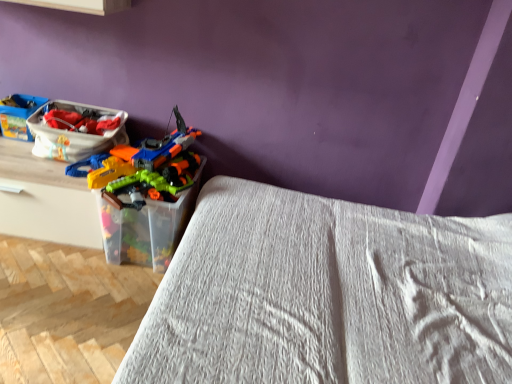
Question: Is translucent plastic container at center positioned beyond the bounds of matte plastic toy boat at left, marked as the first kit in a left-to-right arrangement?

Choices:
 (A) no
 (B) yes

Answer: (B)

Question: Does translucent plastic container at center have a larger size compared to matte plastic toy boat at left, the second kit when ordered from right to left?

Choices:
 (A) no
 (B) yes

Answer: (B)

Question: Is translucent plastic container at center turned away from matte plastic toy boat at left, the second kit when ordered from right to left?

Choices:
 (A) no
 (B) yes

Answer: (A)

Question: From a real-world perspective, is translucent plastic container at center on top of matte plastic toy boat at left, marked as the first kit in a left-to-right arrangement?

Choices:
 (A) no
 (B) yes

Answer: (A)

Question: Is translucent plastic container at center further to the viewer compared to matte plastic toy boat at left, marked as the first kit in a left-to-right arrangement?

Choices:
 (A) no
 (B) yes

Answer: (A)

Question: Considering the relative positions of translucent plastic container at center and matte plastic toy boat at left, marked as the first kit in a left-to-right arrangement, in the image provided, is translucent plastic container at center in front of matte plastic toy boat at left, marked as the first kit in a left-to-right arrangement,?

Choices:
 (A) yes
 (B) no

Answer: (A)

Question: From a real-world perspective, is matte plastic toy boat at left, the second kit when ordered from right to left, physically above translucent plastic container at center?

Choices:
 (A) no
 (B) yes

Answer: (B)

Question: From the image's perspective, is matte plastic toy boat at left, the second kit when ordered from right to left, located beneath translucent plastic container at center?

Choices:
 (A) no
 (B) yes

Answer: (A)

Question: Is the position of matte plastic toy boat at left, the second kit when ordered from right to left, more distant than that of translucent plastic container at center?

Choices:
 (A) yes
 (B) no

Answer: (A)

Question: Is matte plastic toy boat at left, the second kit when ordered from right to left, not within translucent plastic container at center?

Choices:
 (A) no
 (B) yes

Answer: (B)

Question: Is matte plastic toy boat at left, the second kit when ordered from right to left, next to translucent plastic container at center?

Choices:
 (A) no
 (B) yes

Answer: (A)

Question: Are matte plastic toy boat at left, the second kit when ordered from right to left, and translucent plastic container at center located far from each other?

Choices:
 (A) no
 (B) yes

Answer: (A)

Question: Can you confirm if white textured bed at center is bigger than translucent plastic container at center?

Choices:
 (A) no
 (B) yes

Answer: (B)